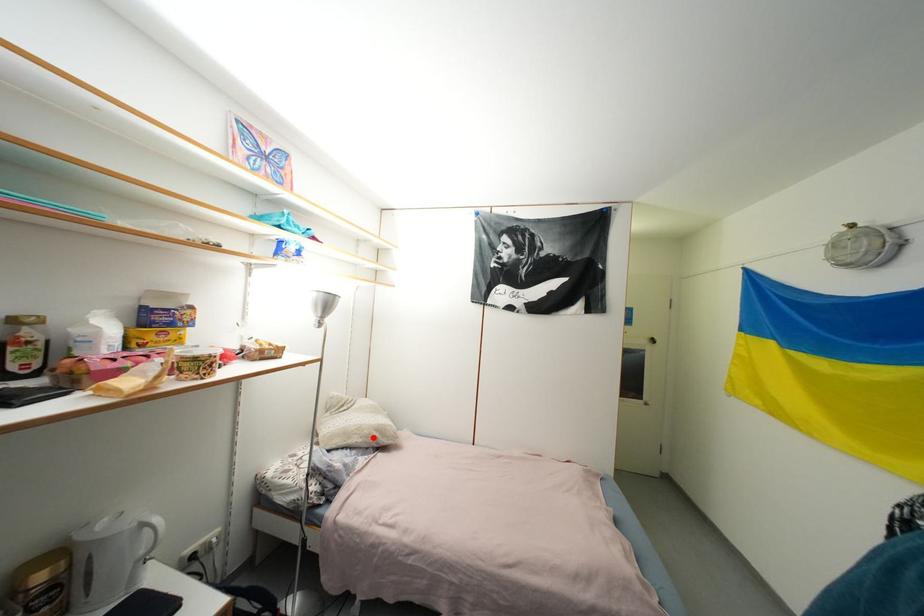
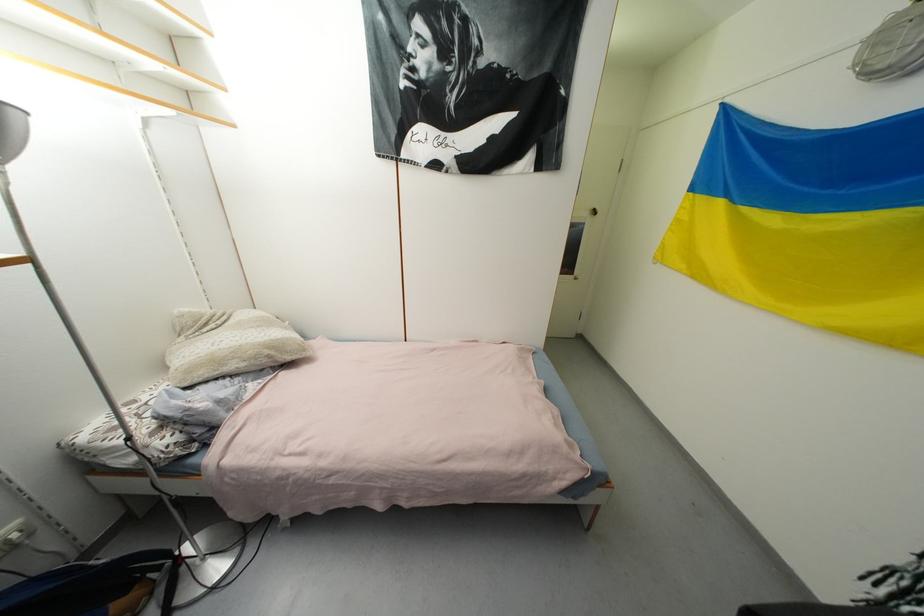
Question: I am providing you with two images of the same scene from different viewpoints. Given a red point in image1, look at the same physical point in image2. Is it:

Choices:
 (A) Closer to the viewpoint
 (B) Farther from the viewpoint

Answer: (A)